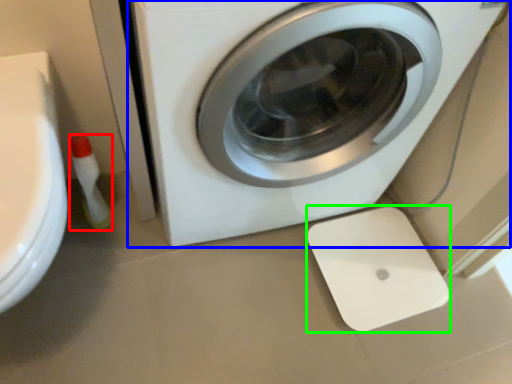
Question: Which is nearer to the cleaning product (highlighted by a red box)? washing machine (highlighted by a blue box) or appliance (highlighted by a green box).

Choices:
 (A) washing machine
 (B) appliance

Answer: (A)